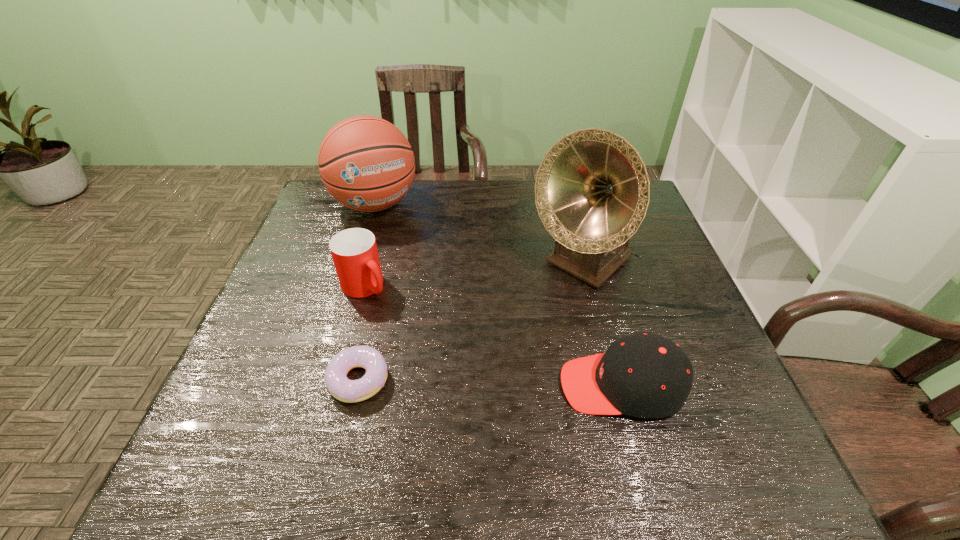
This screenshot has width=960, height=540. I want to click on free space at the right edge of the desktop, so click(636, 286).

Locate an element on the screen. This screenshot has width=960, height=540. empty space between the phonograph record and the cup is located at coordinates (474, 275).

I want to click on unoccupied position between the cup and the phonograph record, so click(474, 275).

Where is `free area in between the phonograph record and the doughnut`? Image resolution: width=960 pixels, height=540 pixels. free area in between the phonograph record and the doughnut is located at coordinates (470, 321).

What are the coordinates of `empty space that is in between the cap and the doughnut` in the screenshot? It's located at (491, 383).

You are a GUI agent. You are given a task and a screenshot of the screen. Output one action in this format:
    pyautogui.click(x=<x>, y=<y>)
    Task: Click on the blank region between the tallest object and the cup
    
    Given the screenshot: What is the action you would take?
    pyautogui.click(x=474, y=275)

What are the coordinates of `vacant space that is in between the fourth tallest object and the phonograph record` in the screenshot? It's located at (602, 325).

Locate which object ranks third in proximity to the cap. Please provide its 2D coordinates. Your answer should be formatted as a tuple, i.e. [(x, y)], where the tuple contains the x and y coordinates of a point satisfying the conditions above.

[(354, 251)]

This screenshot has height=540, width=960. In order to click on object that can be found as the second closest to the cup in this screenshot , I will do `click(366, 163)`.

Locate an element on the screen. This screenshot has width=960, height=540. vacant space that satisfies the following two spatial constraints: 1. on the front side of the shortest object; 2. on the right side of the farthest object is located at coordinates (321, 380).